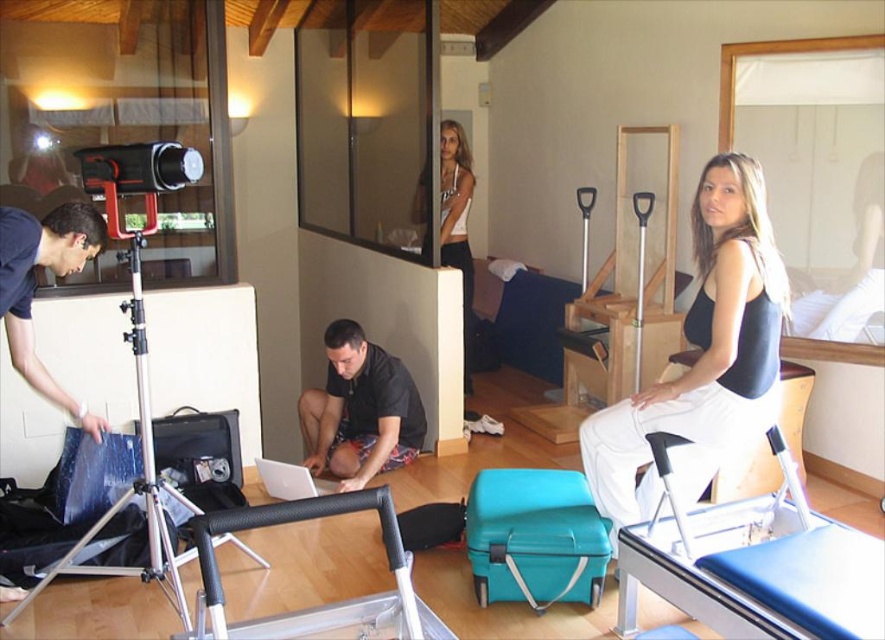
You are a photographer setting up a shoot in this fitness studio. You need to position a light source to the right of both the matte black tank top at center and the white tank top at upper center. Based on their positions, which tank top should the light source be placed to the right of?

The light source should be placed to the right of the matte black tank top at center because it is already positioned to the right of the white tank top at upper center.

You are setting up a presentation in the fitness studio. You have a silver metallic tripod at left and a white plastic laptop at center. Which object should you choose to place a large projector on top?

The silver metallic tripod at left is larger in size than the white plastic laptop at center, so you should choose the silver metallic tripod at left to place the large projector on top since it can support larger items.

You are standing in the fitness studio and want to place a small potted plant between the two points labeled point [730,371] and point [441,177]. Which point should the plant be closer to in order to be nearer to the camera?

The plant should be closer to point [730,371] because it is closer to the camera than point [441,177].